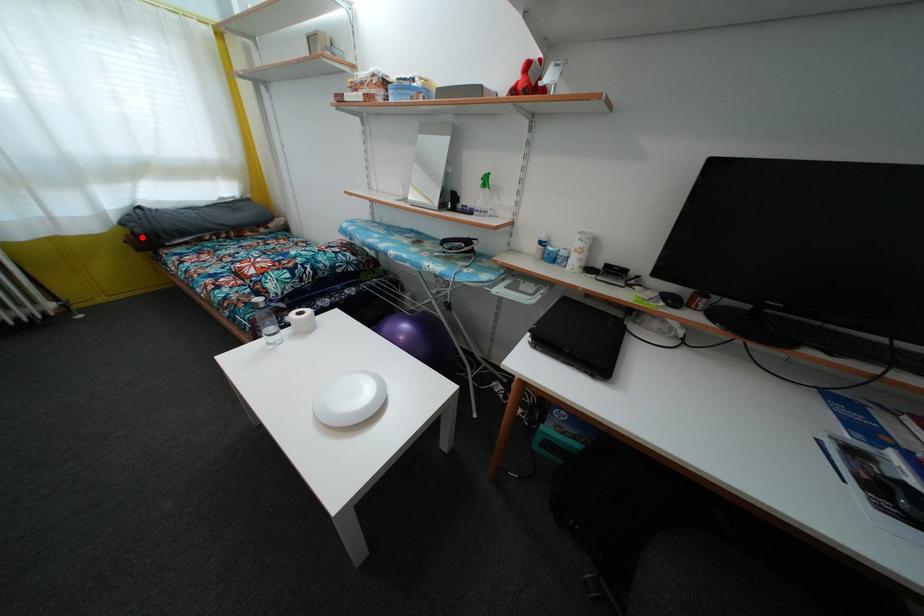
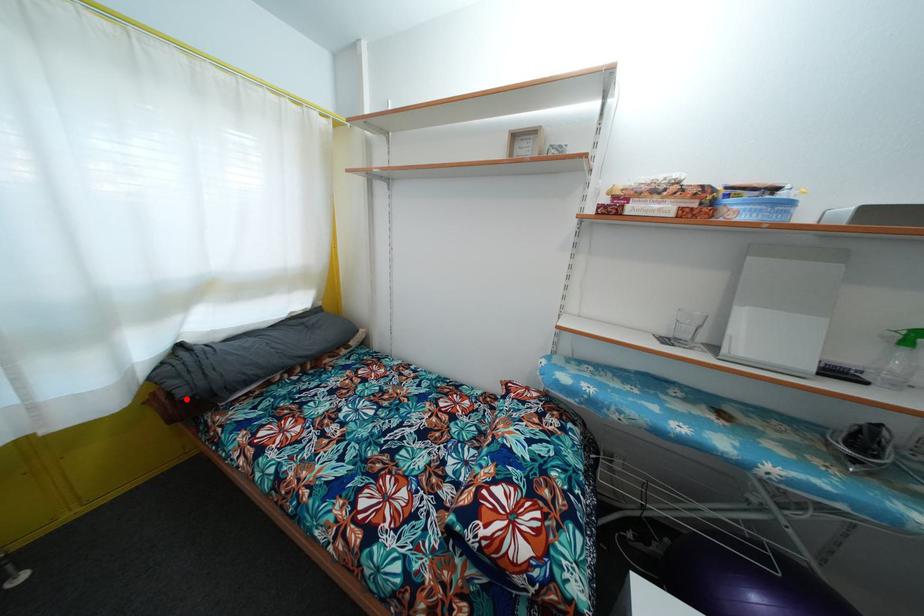
I am providing you with two images of the same scene from different viewpoints. A red point is marked on the first image and another point is marked on the second image. Are the points marked in image1 and image2 representing the same 3D position?

Yes